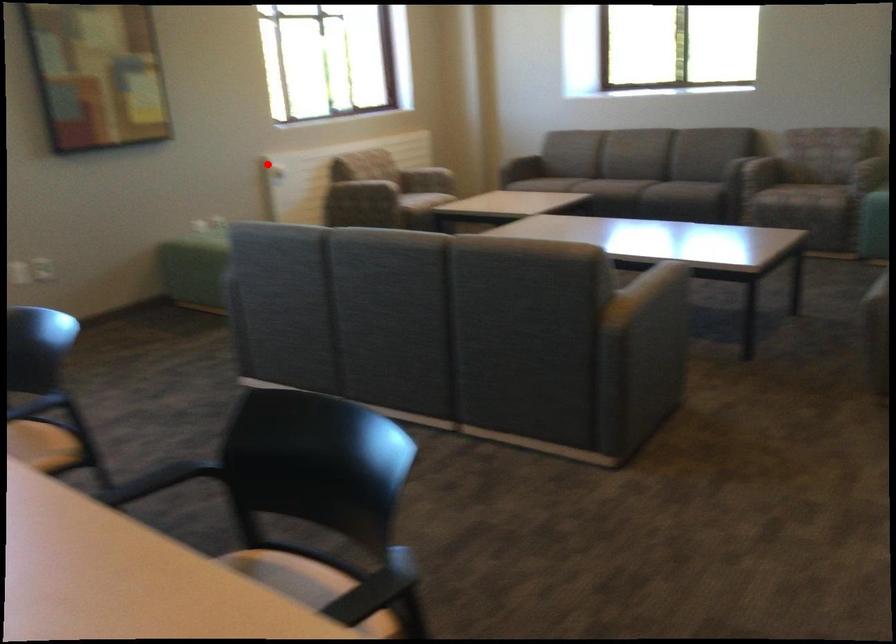
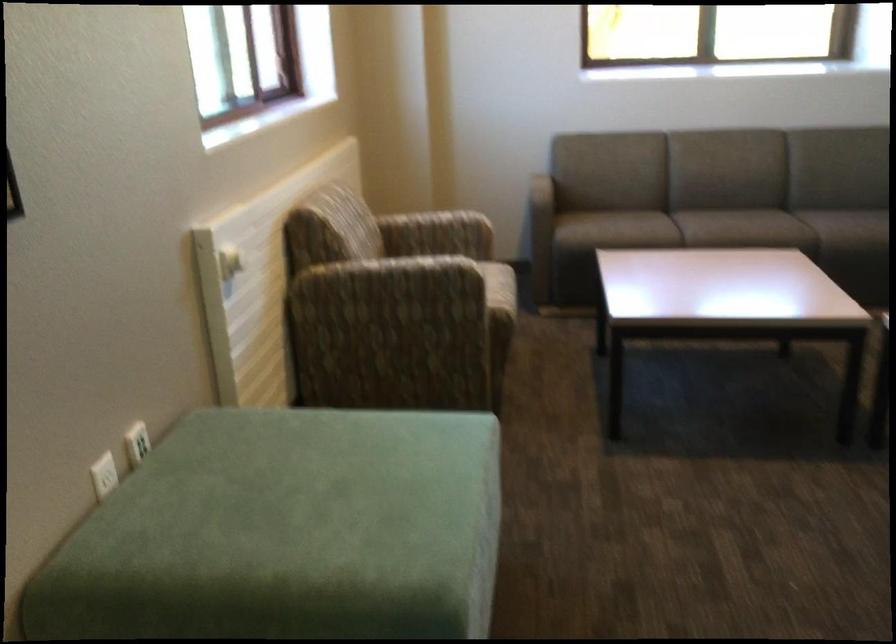
Question: A red point is marked in image1. In image2, is the corresponding 3D point closer to the camera or farther? Reply with the corresponding letter.

Choices:
 (A) The corresponding 3D point is closer.
 (B) The corresponding 3D point is farther.

Answer: (A)